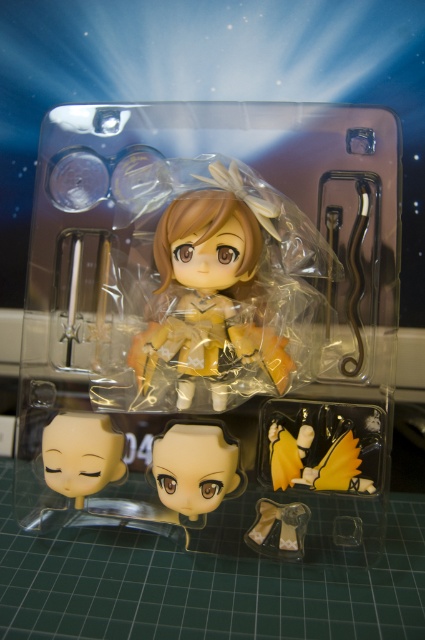
Question: Which object is positioned farthest from the translucent plastic doll at center?

Choices:
 (A) matte yellow head at lower left
 (B) matte beige fabric skirt at lower center
 (C) translucent plastic figure at center
 (D) yellow matte hair clip at lower right

Answer: (B)

Question: From the image, what is the correct spatial relationship of yellow matte hair clip at lower right in relation to matte beige fabric skirt at lower center?

Choices:
 (A) above
 (B) below

Answer: (A)

Question: Does translucent plastic figure at center have a smaller size compared to translucent plastic head at center?

Choices:
 (A) yes
 (B) no

Answer: (B)

Question: Which object is positioned closest to the translucent plastic figure at center?

Choices:
 (A) matte beige fabric skirt at lower center
 (B) matte yellow head at lower left
 (C) translucent plastic doll at center
 (D) translucent plastic head at center

Answer: (C)

Question: Among these points, which one is farthest from the camera?

Choices:
 (A) (297, 525)
 (B) (45, 461)
 (C) (308, 465)

Answer: (A)

Question: From the image, what is the correct spatial relationship of translucent plastic figure at center in relation to matte yellow head at lower left?

Choices:
 (A) left
 (B) right

Answer: (B)